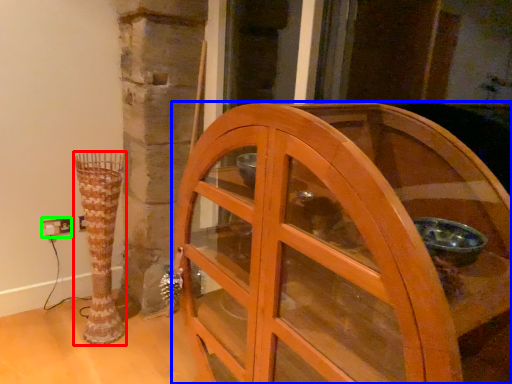
Question: Which is nearer to the vase (highlighted by a red box)? furniture (highlighted by a blue box) or electric outlet (highlighted by a green box).

Choices:
 (A) furniture
 (B) electric outlet

Answer: (B)